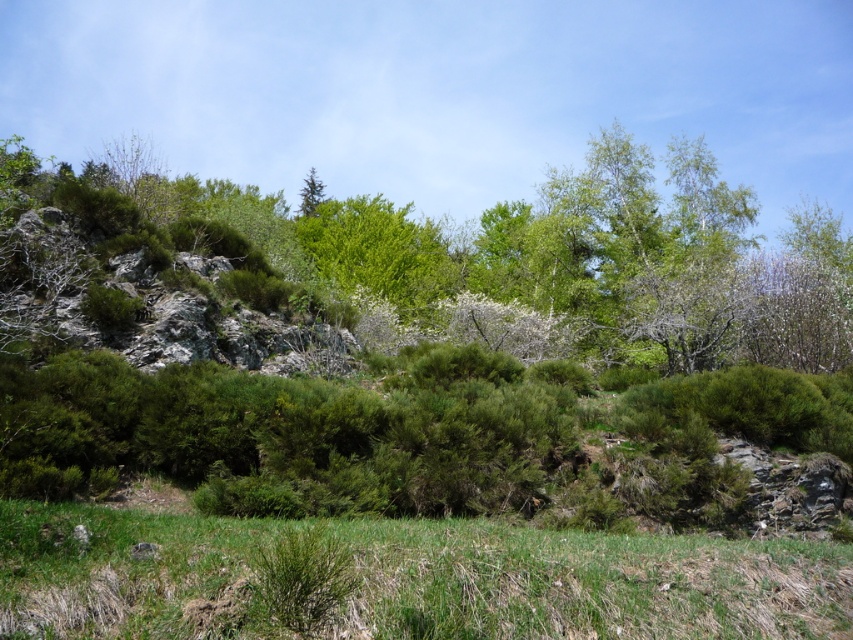
Is green leafy tree at upper center taller than green matte tree at upper center?

Correct, green leafy tree at upper center is much taller as green matte tree at upper center.

Does green leafy tree at upper center have a lesser height compared to green matte tree at upper center?

Incorrect, green leafy tree at upper center's height does not fall short of green matte tree at upper center's.

Find the location of a particular element. green leafy tree at upper center is located at coordinates (498, 252).

Which is above, green grassy at lower center or green matte tree at upper center?

green matte tree at upper center is above.

Can you confirm if green grassy at lower center is thinner than green matte tree at upper center?

Correct, green grassy at lower center's width is less than green matte tree at upper center's.

Where is `green grassy at lower center`? green grassy at lower center is located at coordinates (584, 582).

Measure the distance from green leafy tree at upper center to green grassy at lower center.

green leafy tree at upper center is 30.12 meters away from green grassy at lower center.

Who is higher up, green leafy tree at upper center or green grassy at lower center?

Positioned higher is green leafy tree at upper center.

Who is more forward, (x=749, y=324) or (x=804, y=604)?

Point (x=804, y=604)

This screenshot has width=853, height=640. What are the coordinates of `green leafy tree at upper center` in the screenshot? It's located at (498, 252).